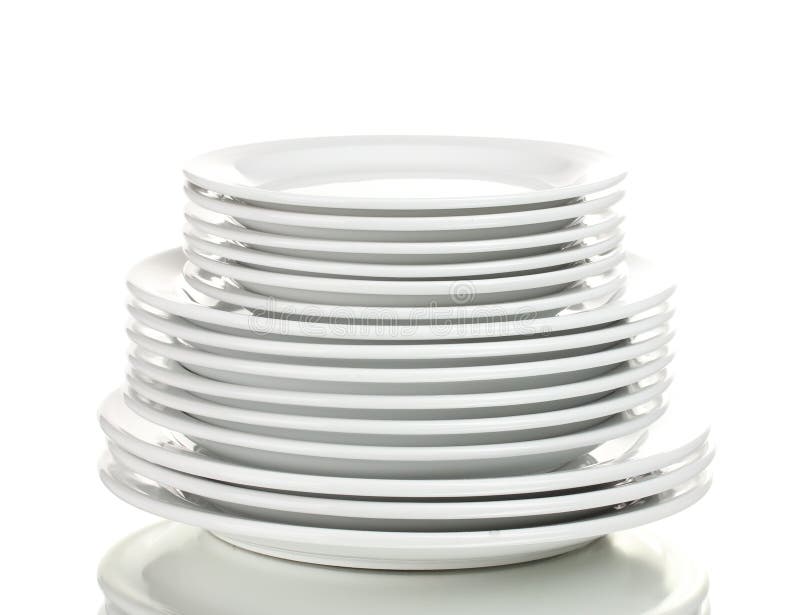
Locate an element on the screen. The height and width of the screenshot is (615, 800). the first 6 plates from the top of the pile is located at coordinates (576, 196), (594, 211), (588, 231), (577, 256), (572, 272), (569, 294).